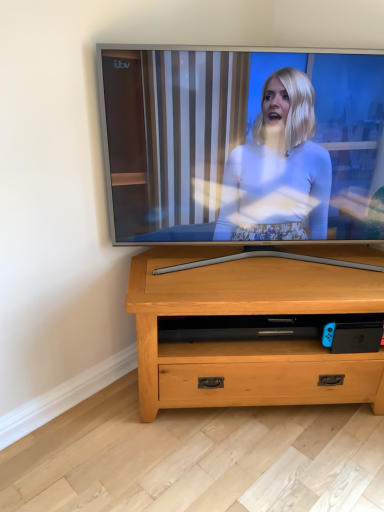
Identify the location of vacant location below silver glossy tv at center (from a real-world perspective). (251, 256).